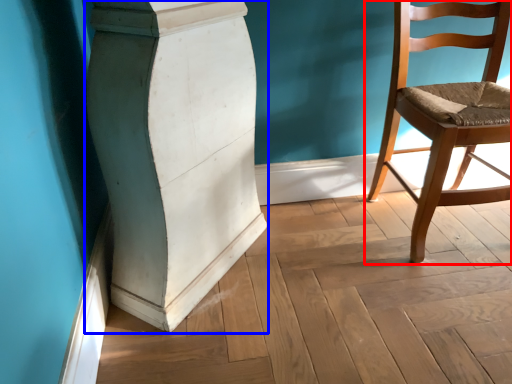
Question: Which object is further to the camera taking this photo, chair (highlighted by a red box) or pillar (highlighted by a blue box)?

Choices:
 (A) chair
 (B) pillar

Answer: (A)